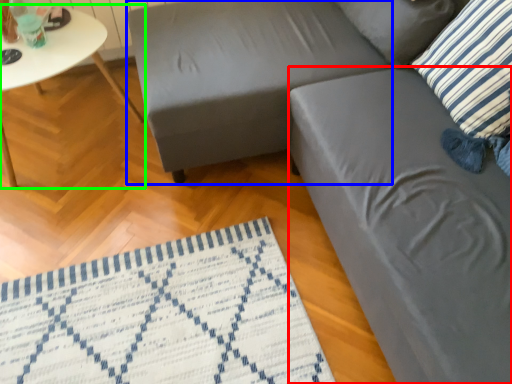
Question: Which object is the closest to the swivel chair (highlighted by a red box)? Choose among these: swivel chair (highlighted by a blue box) or table (highlighted by a green box).

Choices:
 (A) swivel chair
 (B) table

Answer: (A)